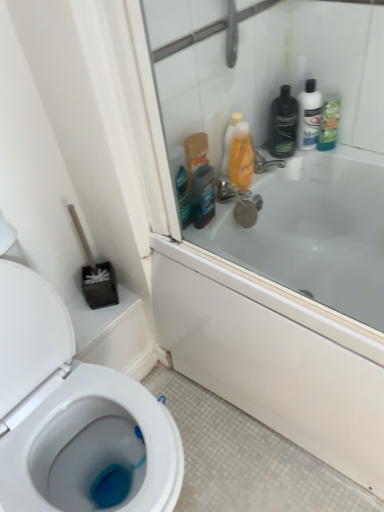
In order to face translucent orange bottle at upper right, the 1th cleaning product in the left-to-right sequence, should I rotate leftwards or rightwards?

A 7.109 degree turn to the right will do.

I want to click on transparent glass screen door at upper right, so click(x=269, y=134).

At what (x,y) coordinates should I click in order to perform the action: click on metallic silver faucet at upper right. Please return your answer as a coordinate pair (x, y). Looking at the image, I should click on (266, 160).

This screenshot has width=384, height=512. In order to click on green matte bottle at upper right, which is counted as the first cleaning product, starting from the right in this screenshot , I will do `click(329, 124)`.

What are the coordinates of `black matte bottle at upper right, the 1th toiletry when ordered from left to right` in the screenshot? It's located at (283, 124).

Locate an element on the screen. The image size is (384, 512). translucent orange bottle at upper right, the second cleaning product viewed from the right is located at coordinates (241, 157).

Can you confirm if metallic silver faucet at upper right is taller than white glossy lotion at upper right, arranged as the 2th toiletry when viewed from the left?

No, metallic silver faucet at upper right is not taller than white glossy lotion at upper right, arranged as the 2th toiletry when viewed from the left.

From the image's perspective, which one is positioned higher, metallic silver faucet at upper right or white glossy lotion at upper right, arranged as the 2th toiletry when viewed from the left?

white glossy lotion at upper right, arranged as the 2th toiletry when viewed from the left.

From a real-world perspective, does metallic silver faucet at upper right stand above white glossy lotion at upper right, positioned as the 1th toiletry in right-to-left order?

Incorrect, from a real-world perspective, metallic silver faucet at upper right is lower than white glossy lotion at upper right, positioned as the 1th toiletry in right-to-left order.

Does green matte bottle at upper right, which is counted as the second cleaning product, starting from the left, turn towards transparent glass screen door at upper right?

No, green matte bottle at upper right, which is counted as the second cleaning product, starting from the left, is not facing towards transparent glass screen door at upper right.

Could you measure the distance between green matte bottle at upper right, which is counted as the first cleaning product, starting from the right, and transparent glass screen door at upper right?

They are 11.48 inches apart.

From the image's perspective, would you say green matte bottle at upper right, which is counted as the second cleaning product, starting from the left, is positioned over transparent glass screen door at upper right?

Yes, from the image's perspective, green matte bottle at upper right, which is counted as the second cleaning product, starting from the left, is on top of transparent glass screen door at upper right.

Is point (333, 126) in front of point (373, 104)?

That is False.

From the image's perspective, is translucent orange bottle at upper right, the 1th cleaning product in the left-to-right sequence, above dark brown plastic mouthwash at upper right?

Yes.

Choose the correct answer: Is translucent orange bottle at upper right, the second cleaning product viewed from the right, inside dark brown plastic mouthwash at upper right or outside it?

translucent orange bottle at upper right, the second cleaning product viewed from the right, is not inside dark brown plastic mouthwash at upper right, it's outside.

Considering the sizes of objects translucent orange bottle at upper right, the second cleaning product viewed from the right, and dark brown plastic mouthwash at upper right in the image provided, who is shorter, translucent orange bottle at upper right, the second cleaning product viewed from the right, or dark brown plastic mouthwash at upper right?

dark brown plastic mouthwash at upper right is shorter.

Is translucent orange bottle at upper right, the second cleaning product viewed from the right, positioned with its back to dark brown plastic mouthwash at upper right?

No.

Would you say white glossy lotion at upper right, positioned as the 1th toiletry in right-to-left order, contains black matte bottle at upper right, the 2th toiletry from the right?

No, white glossy lotion at upper right, positioned as the 1th toiletry in right-to-left order, does not contain black matte bottle at upper right, the 2th toiletry from the right.

From the image's perspective, is white glossy lotion at upper right, positioned as the 1th toiletry in right-to-left order, above or below black matte bottle at upper right, the 2th toiletry from the right?

white glossy lotion at upper right, positioned as the 1th toiletry in right-to-left order, is situated higher than black matte bottle at upper right, the 2th toiletry from the right, in the image.

Is white glossy lotion at upper right, positioned as the 1th toiletry in right-to-left order, far from black matte bottle at upper right, the 1th toiletry when ordered from left to right?

No, there isn't a large distance between white glossy lotion at upper right, positioned as the 1th toiletry in right-to-left order, and black matte bottle at upper right, the 1th toiletry when ordered from left to right.

From the picture: Looking at their sizes, would you say white glossy lotion at upper right, arranged as the 2th toiletry when viewed from the left, is wider or thinner than black matte bottle at upper right, the 1th toiletry when ordered from left to right?

In the image, white glossy lotion at upper right, arranged as the 2th toiletry when viewed from the left, appears to be more narrow than black matte bottle at upper right, the 1th toiletry when ordered from left to right.

Which is in front, point (331, 106) or point (306, 124)?

Point (331, 106)

From the image's perspective, which one is positioned lower, green matte bottle at upper right, which is counted as the second cleaning product, starting from the left, or white glossy lotion at upper right, positioned as the 1th toiletry in right-to-left order?

green matte bottle at upper right, which is counted as the second cleaning product, starting from the left, appears lower in the image.

Is green matte bottle at upper right, which is counted as the second cleaning product, starting from the left, far away from white glossy lotion at upper right, positioned as the 1th toiletry in right-to-left order?

No, there isn't a large distance between green matte bottle at upper right, which is counted as the second cleaning product, starting from the left, and white glossy lotion at upper right, positioned as the 1th toiletry in right-to-left order.

Can you confirm if green matte bottle at upper right, which is counted as the second cleaning product, starting from the left, is bigger than white glossy lotion at upper right, positioned as the 1th toiletry in right-to-left order?

No, green matte bottle at upper right, which is counted as the second cleaning product, starting from the left, is not bigger than white glossy lotion at upper right, positioned as the 1th toiletry in right-to-left order.

From a real-world perspective, is dark brown plastic mouthwash at upper right on white glossy lotion at upper right, positioned as the 1th toiletry in right-to-left order?

No, from a real-world perspective, dark brown plastic mouthwash at upper right is not on top of white glossy lotion at upper right, positioned as the 1th toiletry in right-to-left order.

Considering the relative sizes of dark brown plastic mouthwash at upper right and white glossy lotion at upper right, arranged as the 2th toiletry when viewed from the left, in the image provided, is dark brown plastic mouthwash at upper right wider than white glossy lotion at upper right, arranged as the 2th toiletry when viewed from the left,?

No, dark brown plastic mouthwash at upper right is not wider than white glossy lotion at upper right, arranged as the 2th toiletry when viewed from the left.

Is dark brown plastic mouthwash at upper right facing away from white glossy lotion at upper right, arranged as the 2th toiletry when viewed from the left?

dark brown plastic mouthwash at upper right does not have its back to white glossy lotion at upper right, arranged as the 2th toiletry when viewed from the left.

How many degrees apart are the facing directions of white glossy lotion at upper right, arranged as the 2th toiletry when viewed from the left, and green matte bottle at upper right, which is counted as the first cleaning product, starting from the right?

The angular difference between white glossy lotion at upper right, arranged as the 2th toiletry when viewed from the left, and green matte bottle at upper right, which is counted as the first cleaning product, starting from the right, is 6.79 degrees.

Is green matte bottle at upper right, which is counted as the first cleaning product, starting from the right, a part of white glossy lotion at upper right, positioned as the 1th toiletry in right-to-left order?

That's incorrect, green matte bottle at upper right, which is counted as the first cleaning product, starting from the right, is not inside white glossy lotion at upper right, positioned as the 1th toiletry in right-to-left order.

Looking at this image, is white glossy lotion at upper right, arranged as the 2th toiletry when viewed from the left, wider than green matte bottle at upper right, which is counted as the first cleaning product, starting from the right?

Yes.

Is point (311, 99) positioned after point (333, 132)?

No.

There is a metallic silver faucet at upper right. Where is `the 2nd toiletry above it (from the image's perspective)`? The image size is (384, 512). the 2nd toiletry above it (from the image's perspective) is located at coordinates (309, 115).

In order to click on cleaning product that is the 2nd object located behind the transparent glass screen door at upper right in this screenshot , I will do point(329,124).

Which object lies nearer to the anchor point metallic silver faucet at upper right, transparent glass screen door at upper right or white glossy lotion at upper right, positioned as the 1th toiletry in right-to-left order?

white glossy lotion at upper right, positioned as the 1th toiletry in right-to-left order, lies closer to metallic silver faucet at upper right than the other object.

From the picture: Looking at the image, which one is located further to white glossy lotion at upper right, positioned as the 1th toiletry in right-to-left order, transparent glass screen door at upper right or dark brown plastic mouthwash at upper right?

dark brown plastic mouthwash at upper right.

Which object lies nearer to the anchor point dark brown plastic mouthwash at upper right, white glossy lotion at upper right, arranged as the 2th toiletry when viewed from the left, or translucent orange bottle at upper right, the 1th cleaning product in the left-to-right sequence?

Based on the image, translucent orange bottle at upper right, the 1th cleaning product in the left-to-right sequence, appears to be nearer to dark brown plastic mouthwash at upper right.

Estimate the real-world distances between objects in this image. Which object is closer to transparent glass screen door at upper right, translucent orange bottle at upper right, the second cleaning product viewed from the right, or white glossy lotion at upper right, arranged as the 2th toiletry when viewed from the left?

Among the two, white glossy lotion at upper right, arranged as the 2th toiletry when viewed from the left, is located nearer to transparent glass screen door at upper right.

Considering their positions, is transparent glass screen door at upper right positioned further to metallic silver faucet at upper right than translucent orange bottle at upper right, the second cleaning product viewed from the right?

transparent glass screen door at upper right lies further to metallic silver faucet at upper right than the other object.

Looking at the image, which one is located further to metallic silver faucet at upper right, translucent orange bottle at upper right, the 1th cleaning product in the left-to-right sequence, or dark brown plastic mouthwash at upper right?

dark brown plastic mouthwash at upper right is further to metallic silver faucet at upper right.

When comparing their distances from transparent glass screen door at upper right, does black matte bottle at upper right, the 1th toiletry when ordered from left to right, or metallic silver faucet at upper right seem closer?

The object closer to transparent glass screen door at upper right is black matte bottle at upper right, the 1th toiletry when ordered from left to right.

Looking at this image, looking at the image, which one is located further to black matte bottle at upper right, the 1th toiletry when ordered from left to right, transparent glass screen door at upper right or white glossy lotion at upper right, arranged as the 2th toiletry when viewed from the left?

transparent glass screen door at upper right is further to black matte bottle at upper right, the 1th toiletry when ordered from left to right.

You are a GUI agent. You are given a task and a screenshot of the screen. Output one action in this format:
    pyautogui.click(x=<x>, y=<y>)
    Task: Click on the toiletry between translucent orange bottle at upper right, the 1th cleaning product in the left-to-right sequence, and white glossy lotion at upper right, arranged as the 2th toiletry when viewed from the left, in the horizontal direction
    The height and width of the screenshot is (512, 384).
    Given the screenshot: What is the action you would take?
    tap(283, 124)

Find the location of a particular element. The image size is (384, 512). toiletry between transparent glass screen door at upper right and white glossy lotion at upper right, arranged as the 2th toiletry when viewed from the left, along the z-axis is located at coordinates (283, 124).

Where is `cleaning product between transparent glass screen door at upper right and black matte bottle at upper right, the 2th toiletry from the right, in the front-back direction`? The height and width of the screenshot is (512, 384). cleaning product between transparent glass screen door at upper right and black matte bottle at upper right, the 2th toiletry from the right, in the front-back direction is located at coordinates (241, 157).

Identify the location of toiletry that lies between white glossy lotion at upper right, arranged as the 2th toiletry when viewed from the left, and metallic silver faucet at upper right from top to bottom. (283, 124).